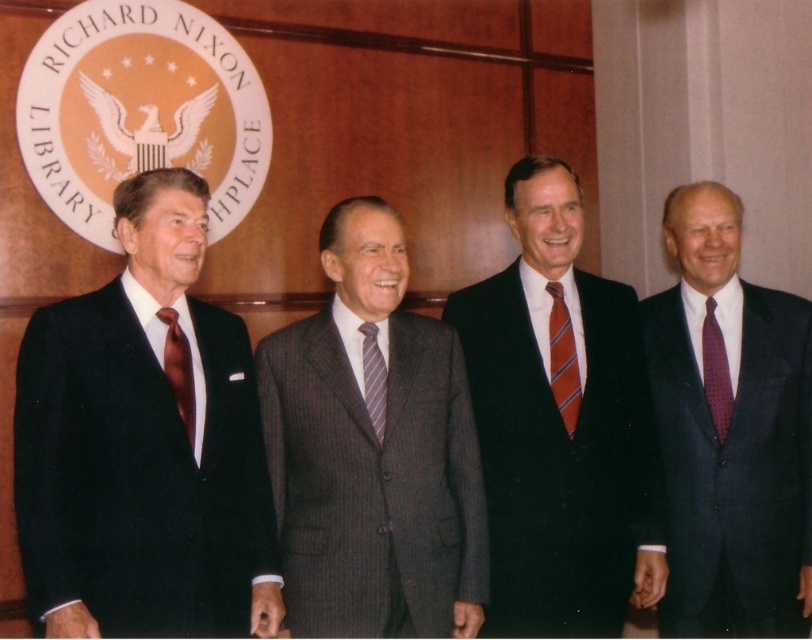
Is striped silk tie at center wider than satin brown tie at left?

Incorrect, striped silk tie at center's width does not surpass satin brown tie at left's.

Between striped silk tie at center and satin brown tie at left, which one appears on the right side from the viewer's perspective?

Positioned to the right is striped silk tie at center.

Measure the distance between point (568, 410) and camera.

They are 8.85 feet apart.

You are a GUI agent. You are given a task and a screenshot of the screen. Output one action in this format:
    pyautogui.click(x=<x>, y=<y>)
    Task: Click on the striped silk tie at center
    The width and height of the screenshot is (812, 640).
    Given the screenshot: What is the action you would take?
    pyautogui.click(x=564, y=358)

Where is `striped silk tie at center`? The width and height of the screenshot is (812, 640). striped silk tie at center is located at coordinates (564, 358).

Who is more forward, (560, 371) or (378, 416)?

Point (378, 416) is in front.

Where is `striped silk tie at center`? The image size is (812, 640). striped silk tie at center is located at coordinates (564, 358).

The height and width of the screenshot is (640, 812). Identify the location of matte black suit at left. (143, 445).

Can you confirm if matte black suit at left is smaller than gray pinstripe suit at center?

No.

In order to click on matte black suit at left in this screenshot , I will do `click(143, 445)`.

At what (x,y) coordinates should I click in order to perform the action: click on matte black suit at left. Please return your answer as a coordinate pair (x, y). Looking at the image, I should click on (143, 445).